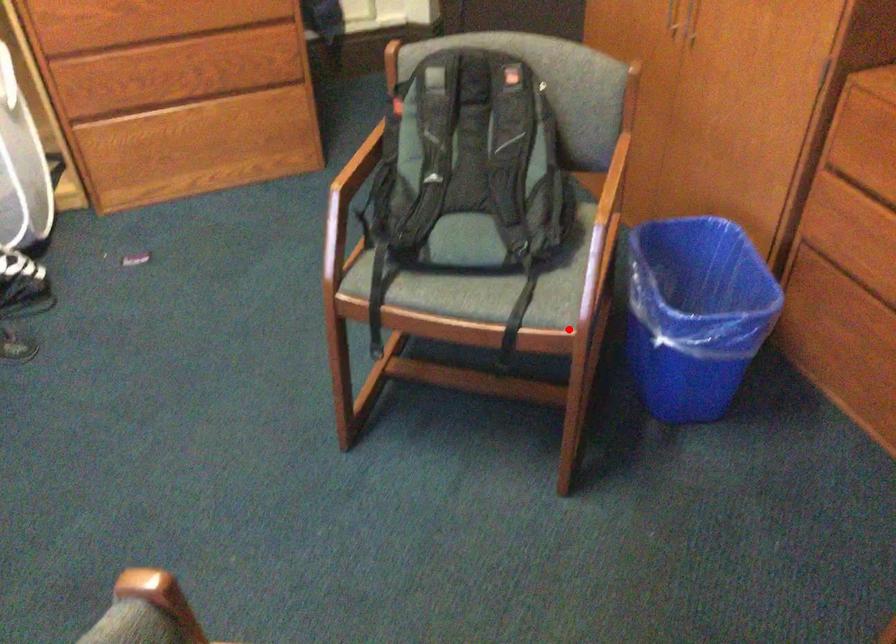
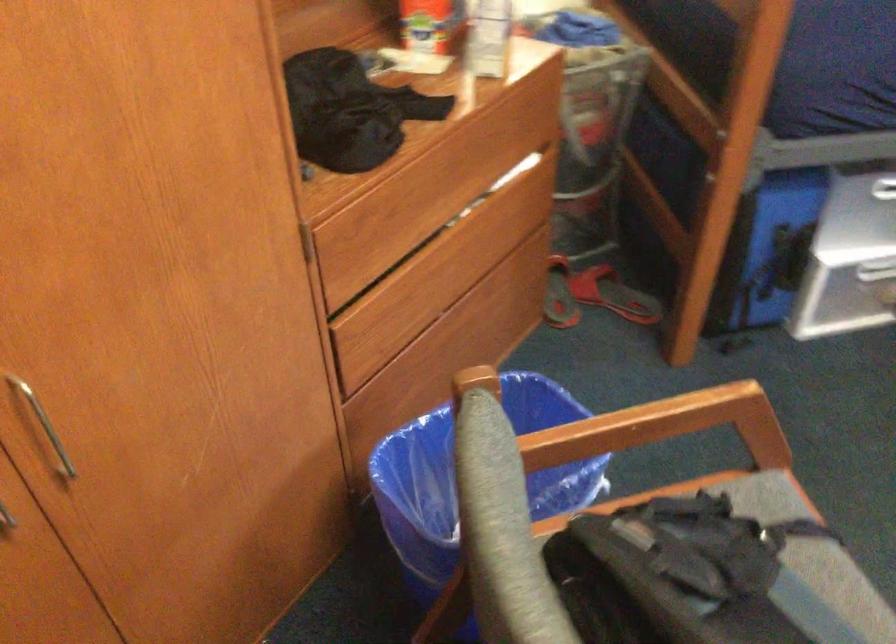
Question: I am providing you with two images of the same scene from different viewpoints. Given a red point in image1, look at the same physical point in image2. Is it:

Choices:
 (A) Closer to the viewpoint
 (B) Farther from the viewpoint

Answer: (A)